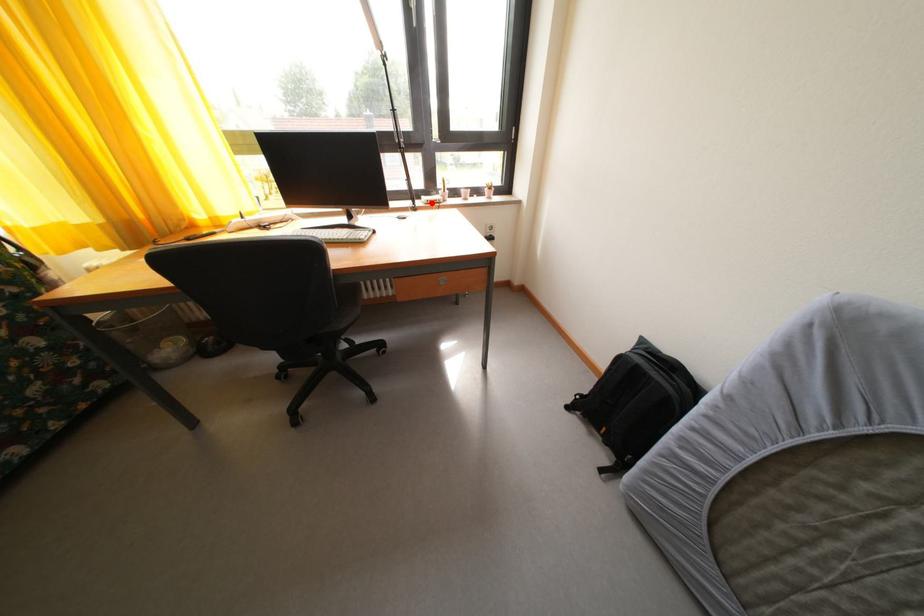
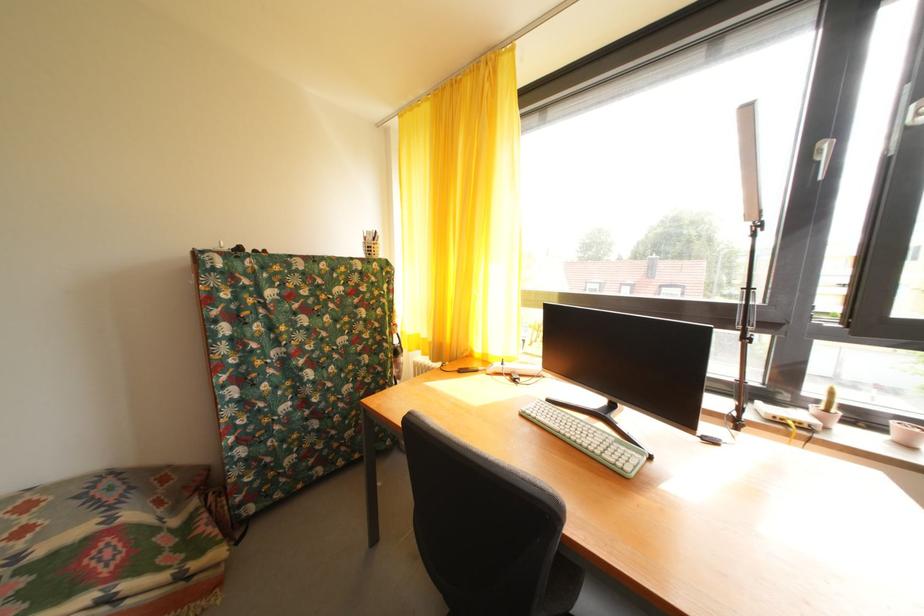
Find the pixel in the second image that matches the highlighted location in the first image.

(768, 408)